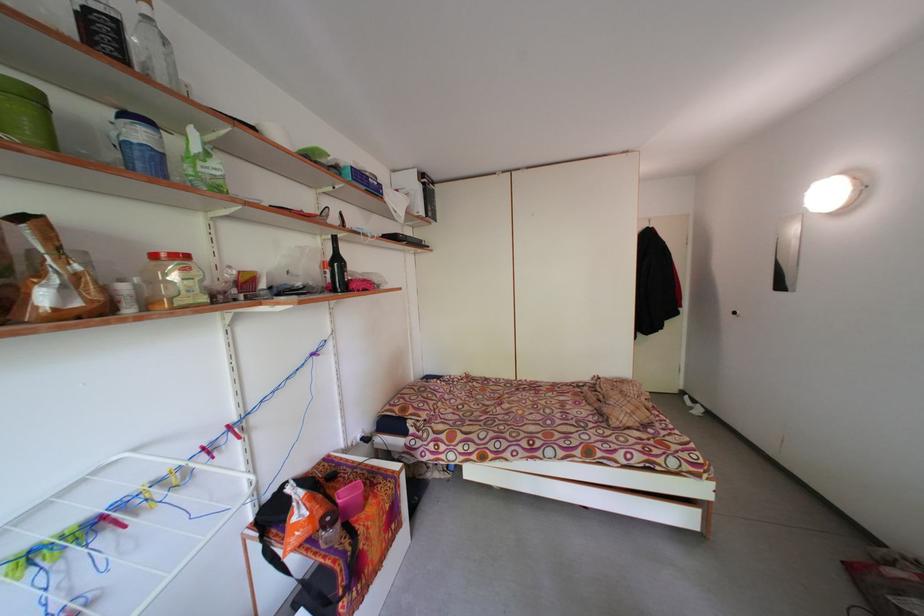
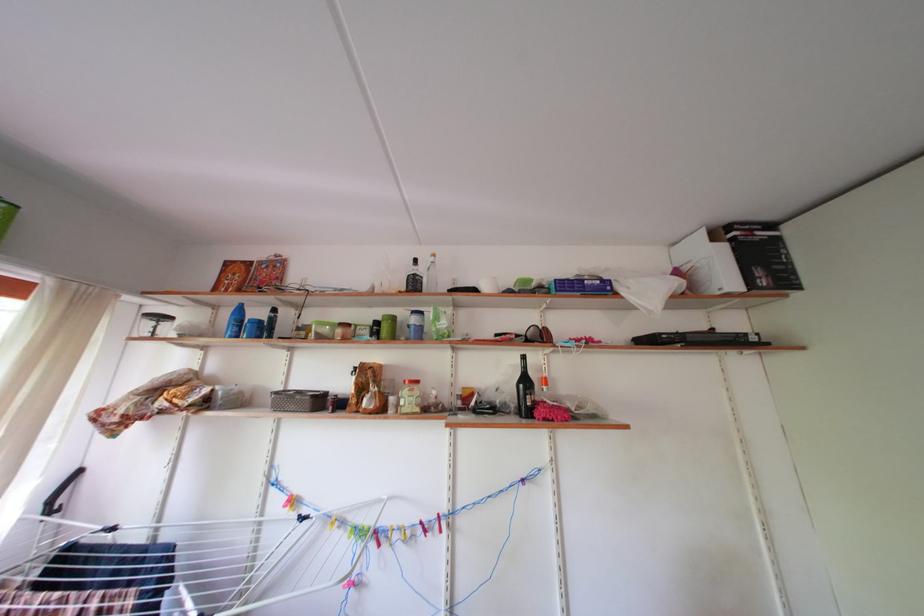
Find the pixel in the second image that matches (377,185) in the first image.

(591, 286)